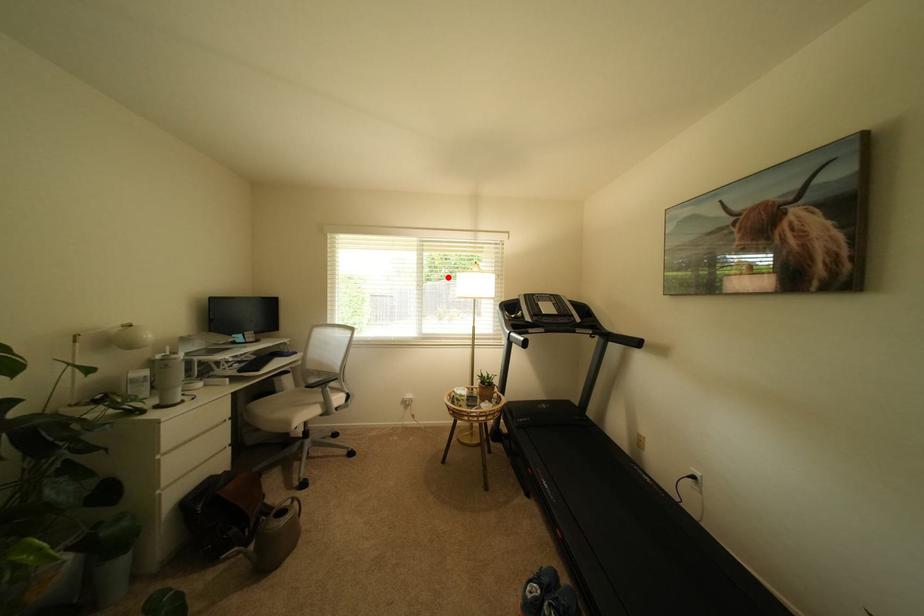
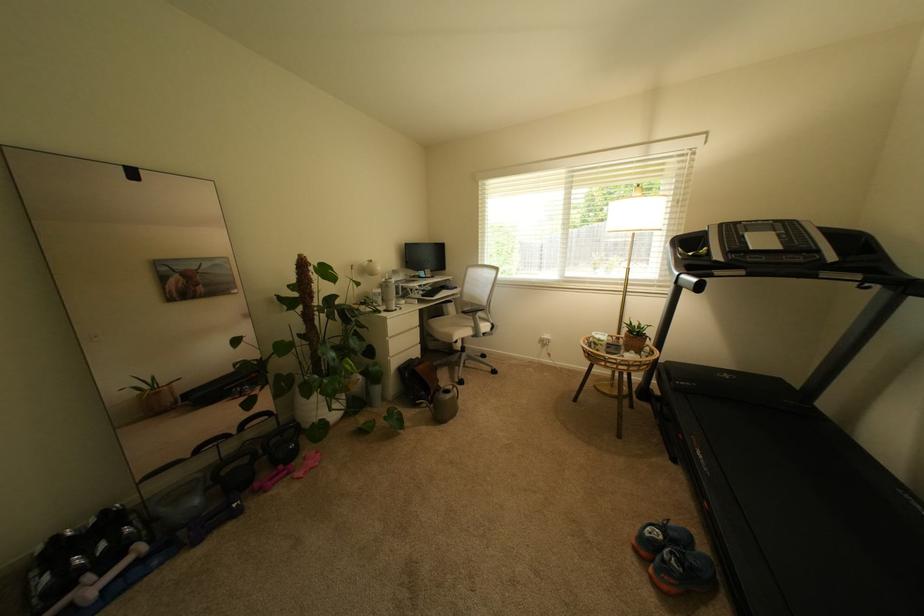
The point at the highlighted location is marked in the first image. Where is the corresponding point in the second image?

(608, 217)